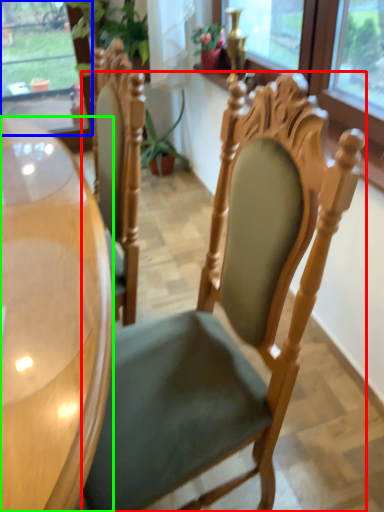
Question: Which is nearer to the chair (highlighted by a red box)? window (highlighted by a blue box) or desk (highlighted by a green box).

Choices:
 (A) window
 (B) desk

Answer: (B)